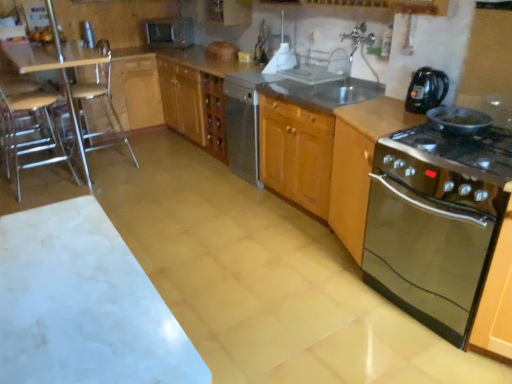
Find the location of a particular element. The image size is (512, 384). free area in between black stainless steel oven at right, placed as the third cabinetry when sorted from back to front, and wooden seat at left, arranged as the second bar stool when viewed from the right is located at coordinates (226, 246).